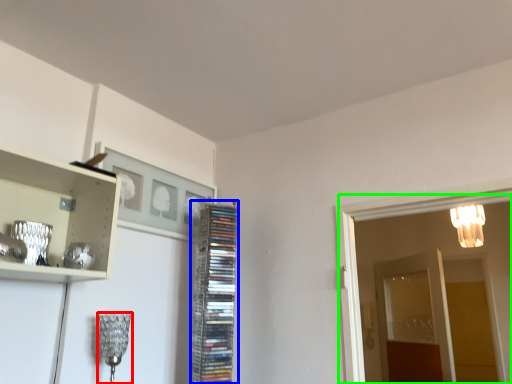
Question: Estimate the real-world distances between objects in this image. Which object is closer to lamp (highlighted by a red box), cabinet (highlighted by a blue box) or glass door (highlighted by a green box)?

Choices:
 (A) cabinet
 (B) glass door

Answer: (A)